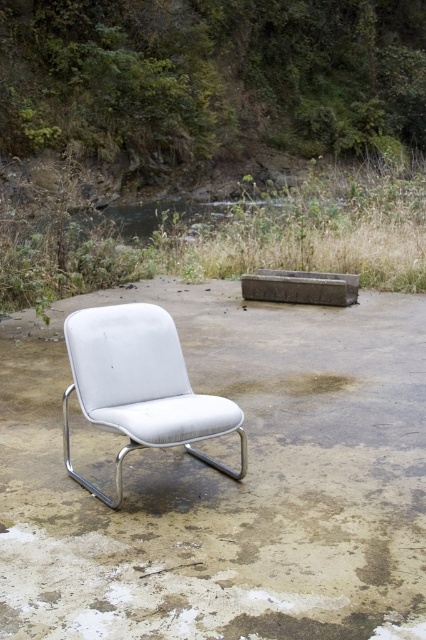
You are standing at the point marked by the coordinates point (229,481), which represents the white leather chair at center. Looking around, you notice a small body of water in the background. In which direction from the white leather chair at center would you need to walk to reach the water?

The small body of water is located behind the dense greenery in the background. Since the white leather chair at center is at the point marked by the coordinates point (229,481), you would need to walk forward towards the background direction to reach the water.

You are planning to place a new white fabric chair at center in the outdoor area shown. However, there is already a white leather chair at center occupying the space. Based on their widths, which chair takes up more horizontal space?

The white leather chair at center has a greater width than the white fabric chair at center, so it occupies more horizontal space.